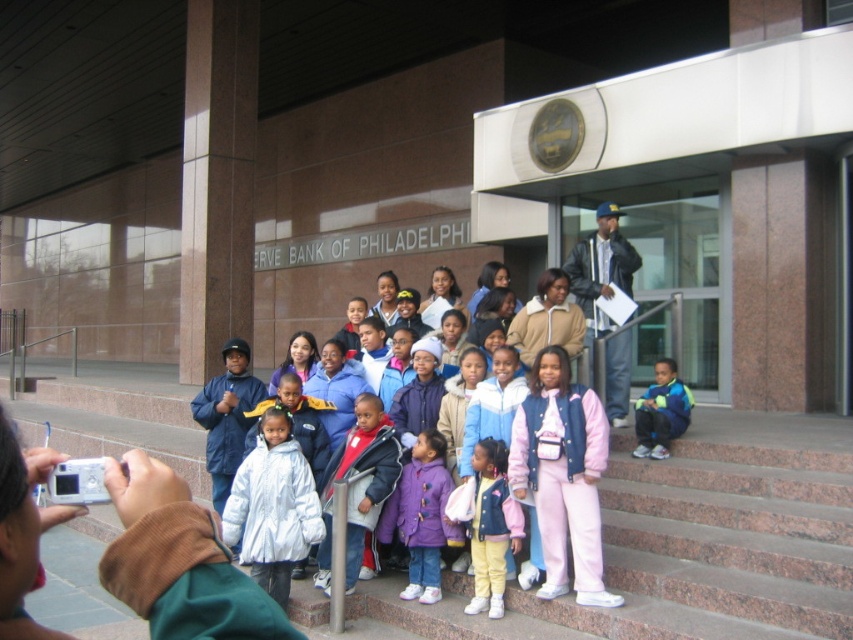
Does black leather jacket at upper center appear over blue fleece jacket at center?

Yes, black leather jacket at upper center is above blue fleece jacket at center.

Does point (595, 278) come farther from viewer compared to point (666, 419)?

Yes.

Who is more forward, (611,388) or (643,424)?

Point (643,424)

You are a GUI agent. You are given a task and a screenshot of the screen. Output one action in this format:
    pyautogui.click(x=<x>, y=<y>)
    Task: Click on the black leather jacket at upper center
    
    Given the screenshot: What is the action you would take?
    pyautogui.click(x=601, y=268)

Who is lower down, white shiny coat at center or black leather jacket at upper center?

white shiny coat at center

Does point (259, 528) lie in front of point (605, 282)?

Yes, point (259, 528) is closer to viewer.

Describe the element at coordinates (273, 506) in the screenshot. The width and height of the screenshot is (853, 640). I see `white shiny coat at center` at that location.

Find the location of a particular element. white shiny coat at center is located at coordinates (273, 506).

Between point (397, 497) and point (495, 600), which one is positioned in front?

Point (495, 600) is in front.

Between purple fleece jacket at center and light purple fleece jacket at center, which one appears on the left side from the viewer's perspective?

From the viewer's perspective, purple fleece jacket at center appears more on the left side.

What do you see at coordinates (421, 516) in the screenshot? This screenshot has width=853, height=640. I see `purple fleece jacket at center` at bounding box center [421, 516].

At what (x,y) coordinates should I click in order to perform the action: click on purple fleece jacket at center. Please return your answer as a coordinate pair (x, y). The width and height of the screenshot is (853, 640). Looking at the image, I should click on (421, 516).